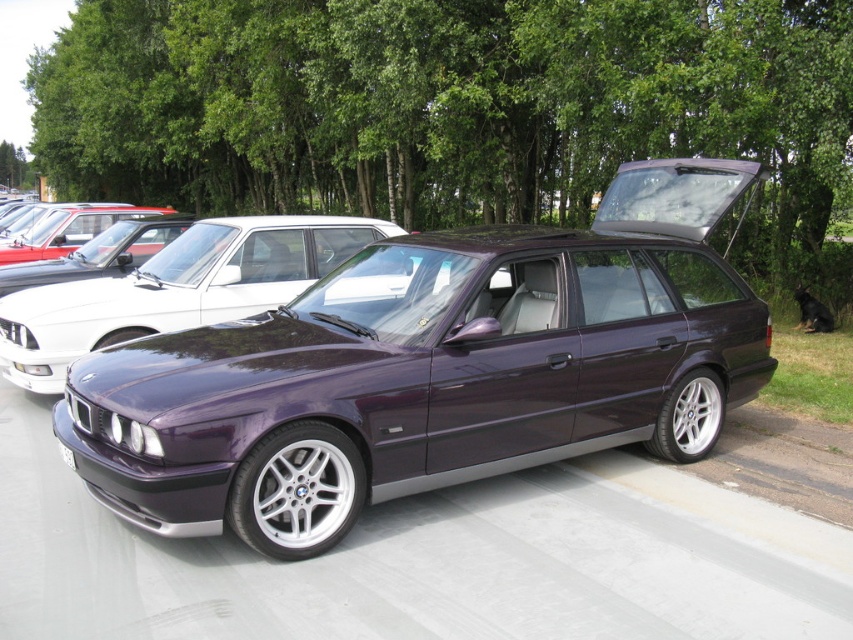
You are a photographer at a car exhibition. You need to capture a photo of the purple metallic car at center and the shiny purple car at center. According to the scene, which one is positioned lower in the image?

The purple metallic car at center is located below the shiny purple car at center, so it is positioned lower in the image.

From the picture: You are a photographer at a car exhibition. You need to capture a photo of the purple metallic car at center and the shiny purple car at center. According to the scene, which car should be placed on the right side in your photo?

The purple metallic car at center should be placed on the right side of the shiny purple car at center in the photo because the purple metallic car at center is positioned on the right side of shiny purple car at center in the scene.

You are standing in front of the dark purple BMW E34 Touring station wagon and want to take a photo. You notice two points on the car, one at point (276, 387) and another at point (167, 208). Which point will appear larger in your photo?

Point (276, 387) will appear larger in the photo because it is closer to the camera than point (167, 208).